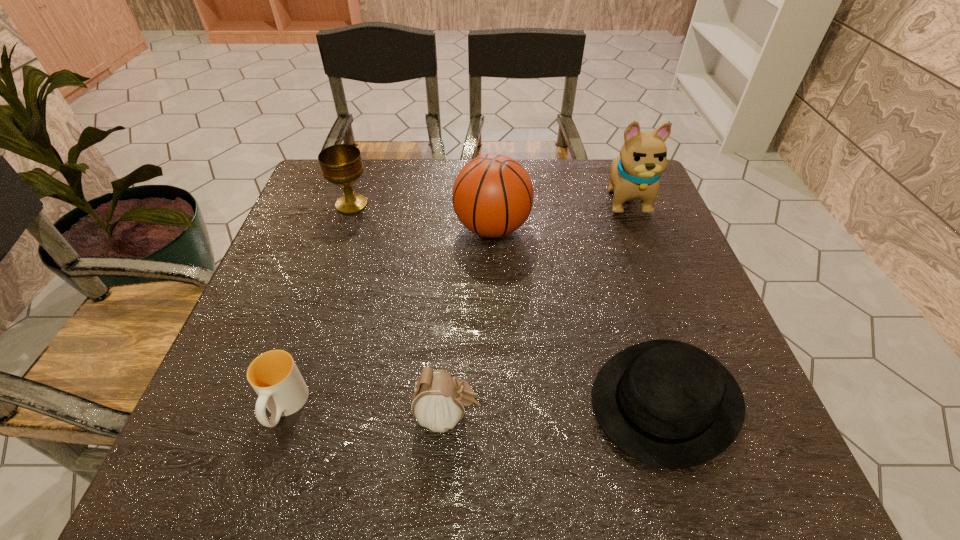
Locate an element on the screen. Image resolution: width=960 pixels, height=540 pixels. vacant space located with the handle on the side of the cup is located at coordinates (259, 482).

Find the location of a particular element. Image resolution: width=960 pixels, height=540 pixels. free space located 0.390m on the back of the fedora is located at coordinates (608, 219).

The image size is (960, 540). I want to click on puppy positioned at the far edge, so click(635, 173).

Locate an element on the screen. The height and width of the screenshot is (540, 960). basketball that is positioned at the far edge is located at coordinates (492, 196).

I want to click on chalice that is at the far edge, so click(x=341, y=164).

You are a GUI agent. You are given a task and a screenshot of the screen. Output one action in this format:
    pyautogui.click(x=<x>, y=<y>)
    Task: Click on the pouch present at the near edge
    
    Given the screenshot: What is the action you would take?
    pyautogui.click(x=439, y=401)

I want to click on cup located in the near edge section of the desktop, so click(274, 376).

This screenshot has width=960, height=540. Find the location of `fedora that is at the near edge`. fedora that is at the near edge is located at coordinates (668, 404).

What are the coordinates of `chalice that is at the left edge` in the screenshot? It's located at (341, 164).

What are the coordinates of `cup at the left edge` in the screenshot? It's located at (274, 376).